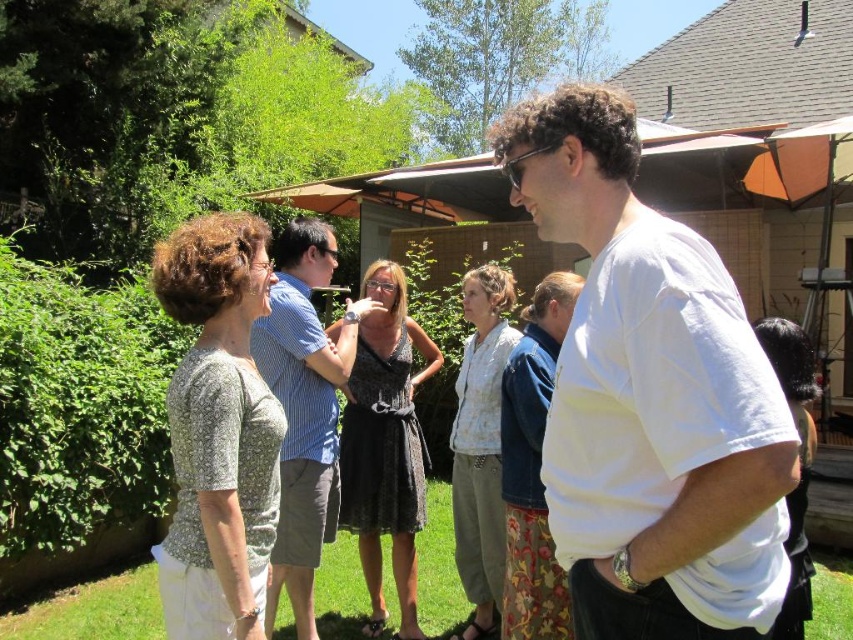
Is point (287, 346) more distant than point (384, 330)?

That is False.

How distant is blue striped shirt at center from black lace dress at center?

The distance of blue striped shirt at center from black lace dress at center is 15.47 inches.

Is point (314, 513) positioned behind point (373, 589)?

No.

The image size is (853, 640). Find the location of `blue striped shirt at center`. blue striped shirt at center is located at coordinates (305, 408).

Is light gray textured blouse at center behind matte black dress at center?

Result: No, it is in front of matte black dress at center.

Which is in front, point (234, 634) or point (798, 580)?

Point (234, 634) is in front.

This screenshot has width=853, height=640. What are the coordinates of `light gray textured blouse at center` in the screenshot? It's located at (218, 429).

Is black lace dress at center to the left of light gray fabric dress at center from the viewer's perspective?

Correct, you'll find black lace dress at center to the left of light gray fabric dress at center.

The image size is (853, 640). Find the location of `black lace dress at center`. black lace dress at center is located at coordinates (386, 445).